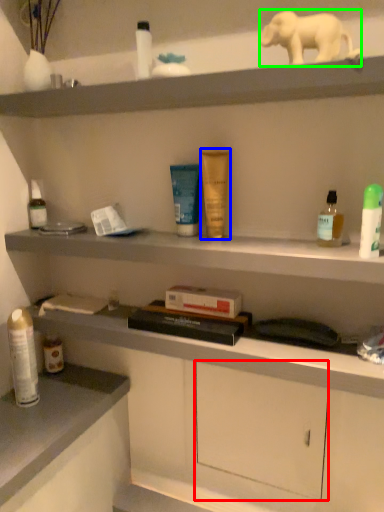
Question: Considering the real-world distances, which object is closest to drawer (highlighted by a red box)? toiletry (highlighted by a blue box) or elephant (highlighted by a green box).

Choices:
 (A) toiletry
 (B) elephant

Answer: (A)